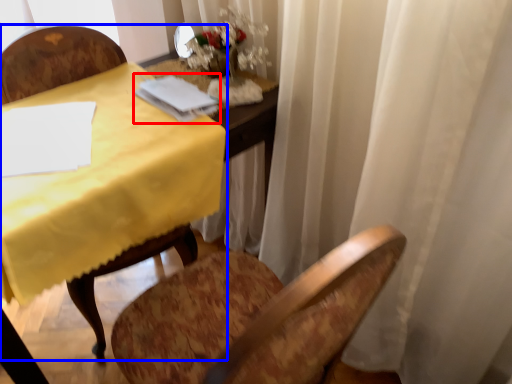
Question: Among these objects, which one is farthest to the camera, notebook (highlighted by a red box) or chair (highlighted by a blue box)?

Choices:
 (A) notebook
 (B) chair

Answer: (A)